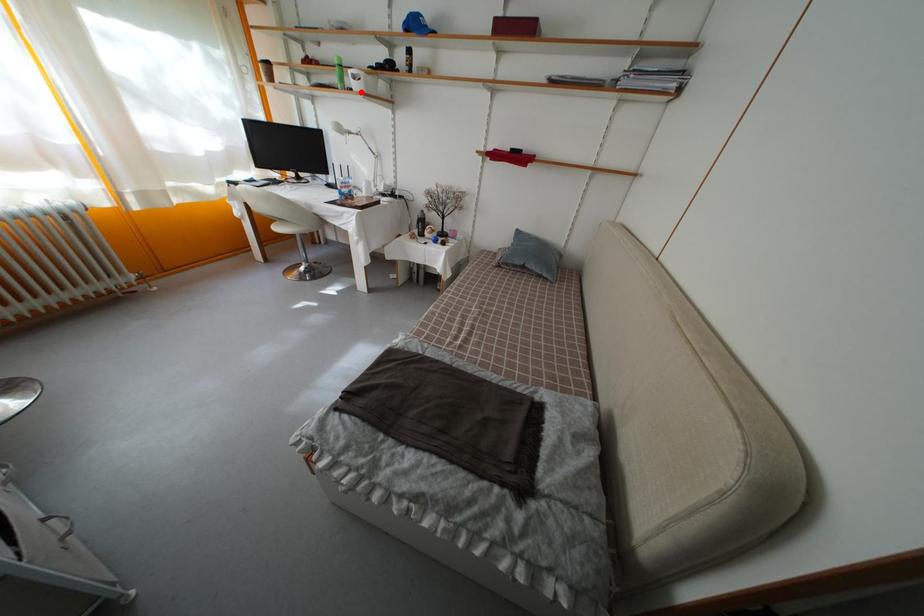
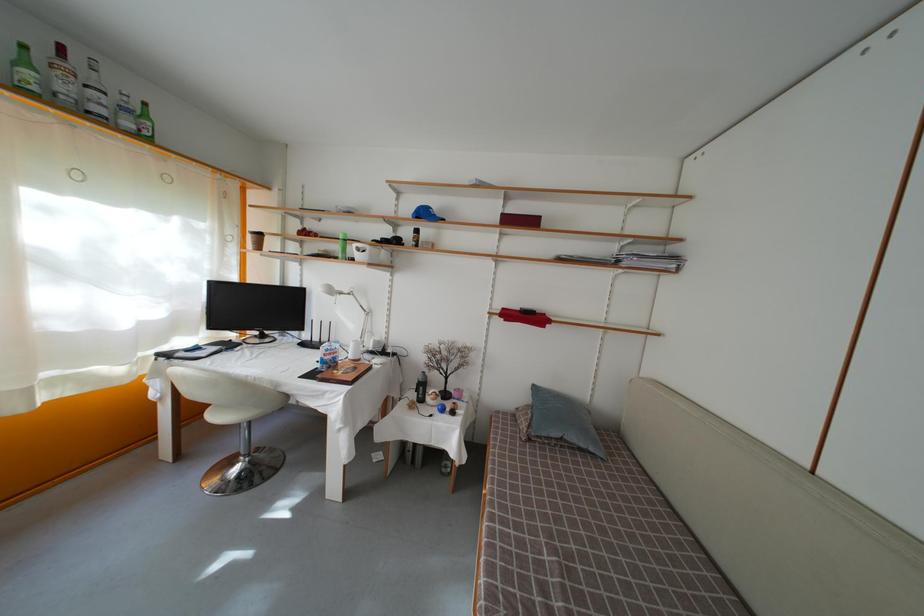
Locate, in the second image, the point that corresponds to the highlighted location in the first image.

(363, 262)